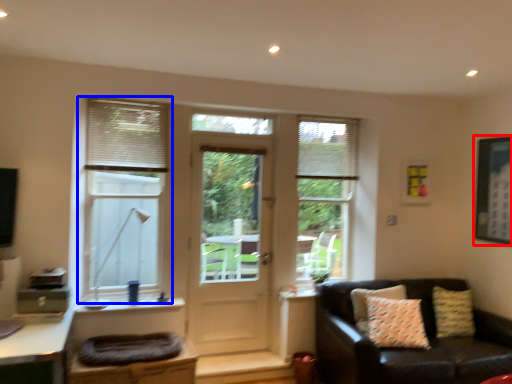
Question: Which object appears closest to the camera in this image, picture frame (highlighted by a red box) or window (highlighted by a blue box)?

Choices:
 (A) picture frame
 (B) window

Answer: (B)